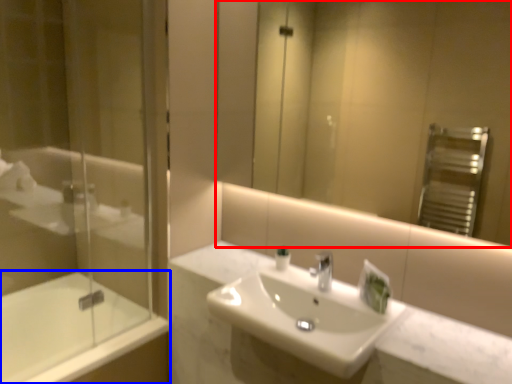
Question: Which object appears closest to the camera in this image, mirror (highlighted by a red box) or bathtub (highlighted by a blue box)?

Choices:
 (A) mirror
 (B) bathtub

Answer: (A)